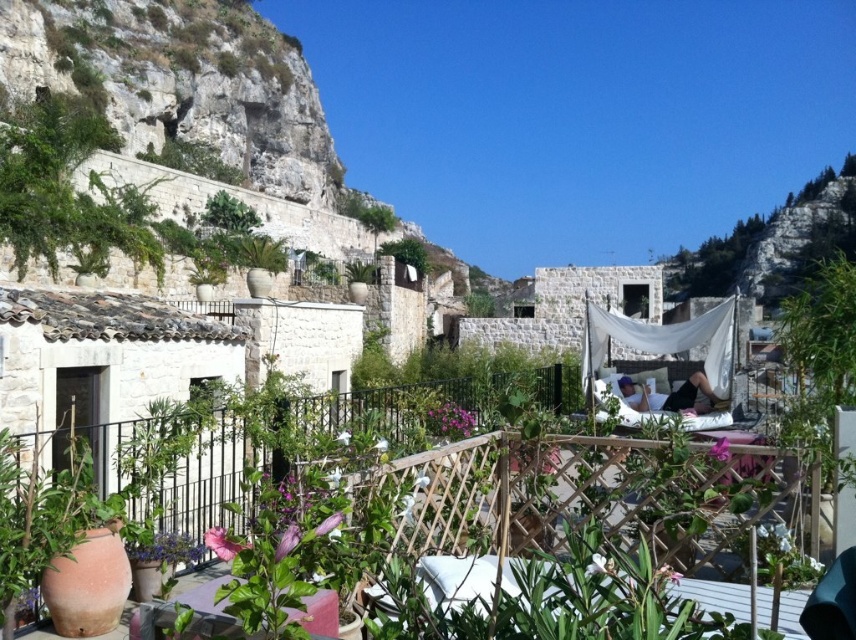
Can you confirm if white fabric canopy at center is positioned below green leafy plant at center?

Yes.

The image size is (856, 640). Describe the element at coordinates (663, 339) in the screenshot. I see `white fabric canopy at center` at that location.

Where is `white fabric canopy at center`? white fabric canopy at center is located at coordinates (663, 339).

Does point (801, 419) lie behind point (411, 257)?

No, it is in front of (411, 257).

Who is positioned more to the left, green bamboo at right or green leafy plant at center?

Positioned to the left is green leafy plant at center.

Is point (783, 433) less distant than point (400, 256)?

Yes, it is.

Where is `green bamboo at right`? The image size is (856, 640). green bamboo at right is located at coordinates (819, 353).

Does point (852, 282) come closer to viewer compared to point (657, 346)?

Yes, point (852, 282) is closer to viewer.

Identify the location of green bamboo at right. (819, 353).

Is point (813, 433) more distant than point (634, 323)?

That is False.

Locate an element on the screen. The image size is (856, 640). green bamboo at right is located at coordinates (819, 353).